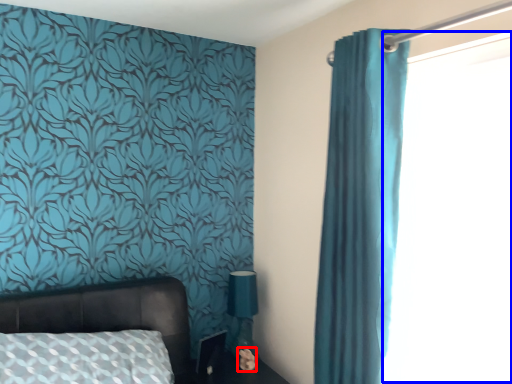
Question: Which object appears farthest to the camera in this image, flower (highlighted by a red box) or window screen (highlighted by a blue box)?

Choices:
 (A) flower
 (B) window screen

Answer: (A)